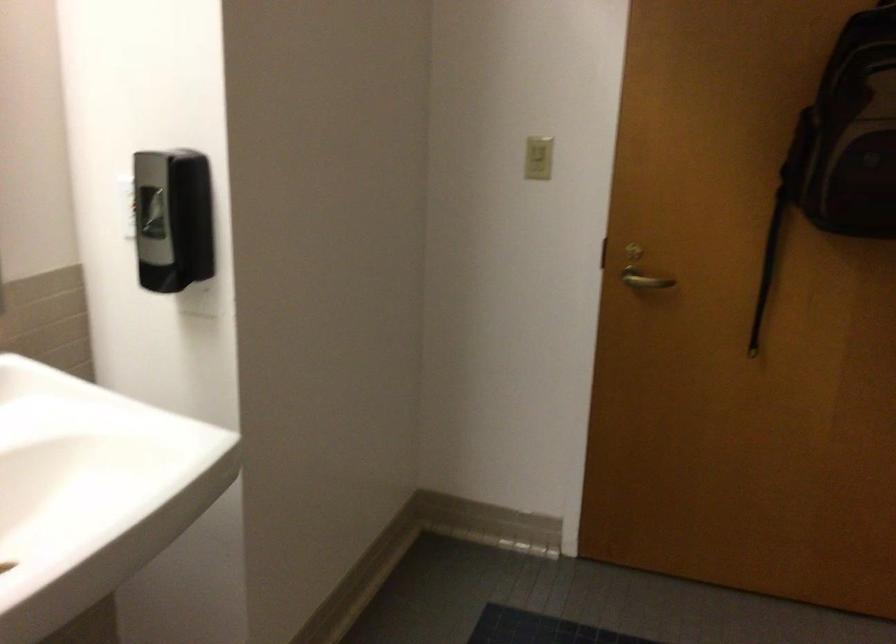
The image size is (896, 644). What do you see at coordinates (150, 212) in the screenshot?
I see `the soap dispenser lever` at bounding box center [150, 212].